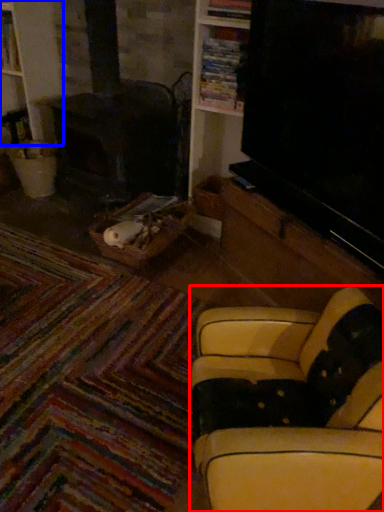
Question: Among these objects, which one is nearest to the camera, studio couch (highlighted by a red box) or bookshelf (highlighted by a blue box)?

Choices:
 (A) studio couch
 (B) bookshelf

Answer: (A)